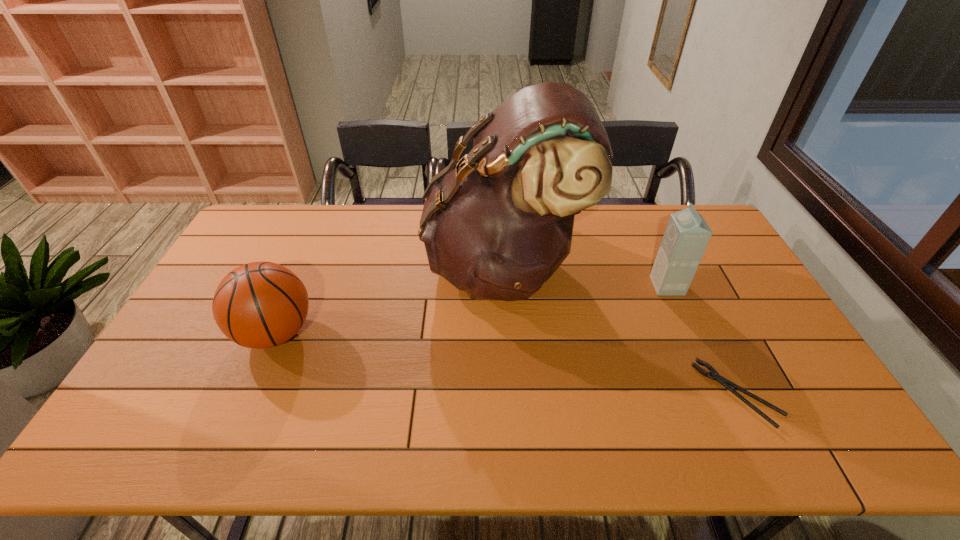
Locate an element on the screen. The height and width of the screenshot is (540, 960). free spot located on the front label of the carton is located at coordinates (571, 286).

At what (x,y) coordinates should I click in order to perform the action: click on free space located on the front label of the carton. Please return your answer as a coordinate pair (x, y). This screenshot has width=960, height=540. Looking at the image, I should click on (609, 286).

What are the coordinates of `vacant space located on the back of the third tallest object` in the screenshot? It's located at (322, 229).

I want to click on vacant position located on the back of the tongs, so click(x=692, y=300).

Image resolution: width=960 pixels, height=540 pixels. I want to click on object present at the far edge, so click(497, 224).

Locate an element on the screen. Image resolution: width=960 pixels, height=540 pixels. object that is positioned at the near edge is located at coordinates (714, 375).

The height and width of the screenshot is (540, 960). What are the coordinates of `object at the right edge` in the screenshot? It's located at (714, 375).

Find the location of a particular element. object that is at the near right corner is located at coordinates (714, 375).

Locate an element on the screen. This screenshot has width=960, height=540. vacant area at the far edge is located at coordinates (658, 224).

This screenshot has width=960, height=540. I want to click on vacant space at the near edge, so click(x=767, y=427).